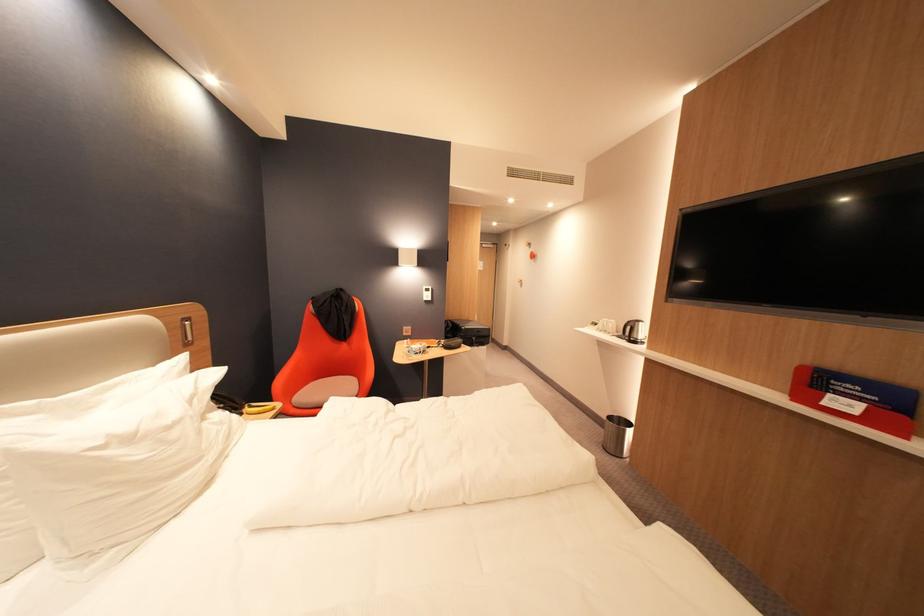
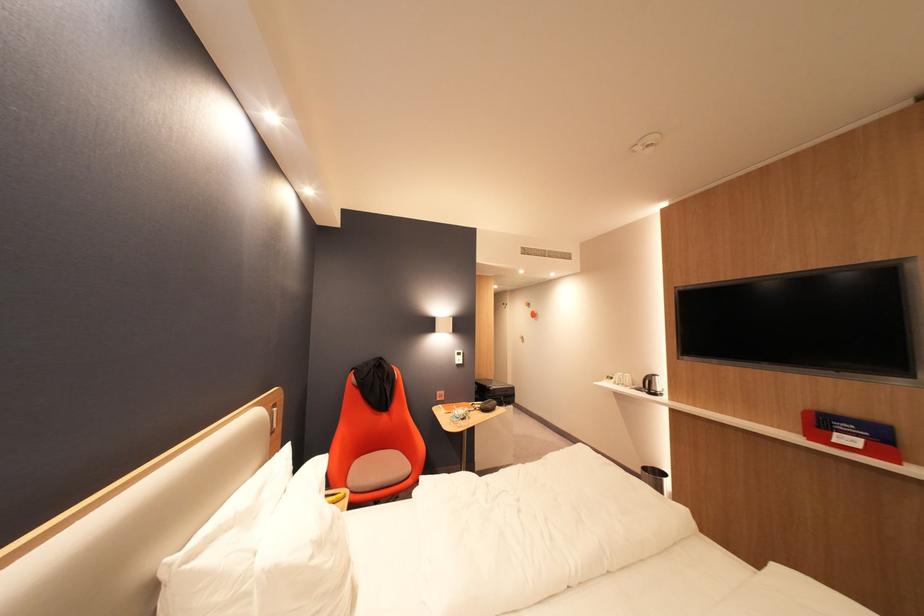
In the second image, find the point that corresponds to point (606, 325) in the first image.

(622, 379)